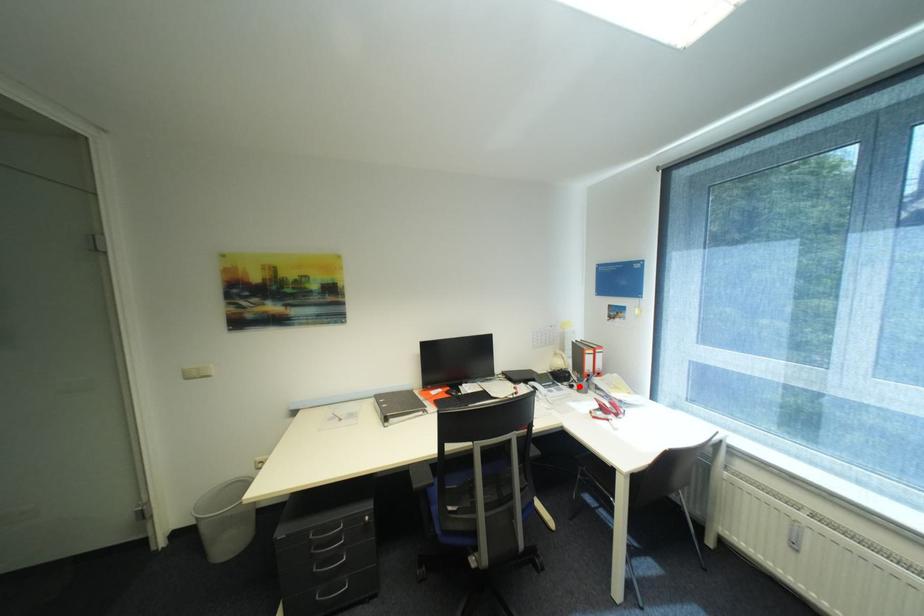
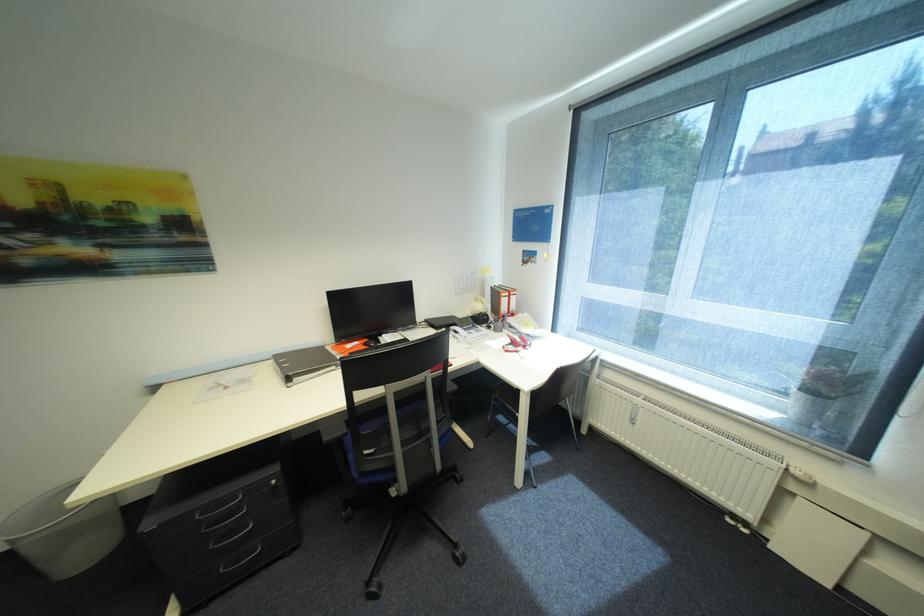
Question: I am providing you with two images of the same scene from different viewpoints. A red point is marked on the first image. Can you still see the location of the red point in image 2?

Choices:
 (A) Yes
 (B) No

Answer: (A)